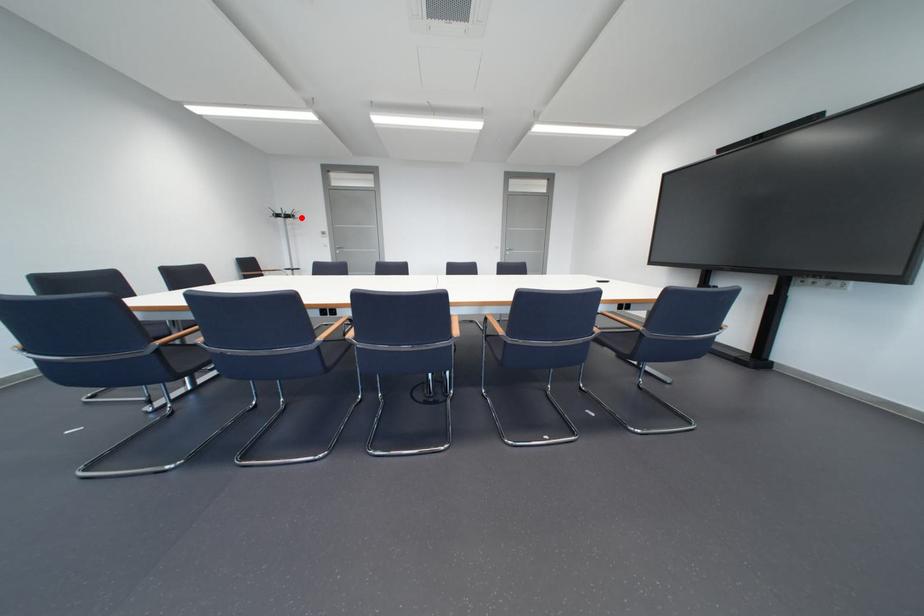
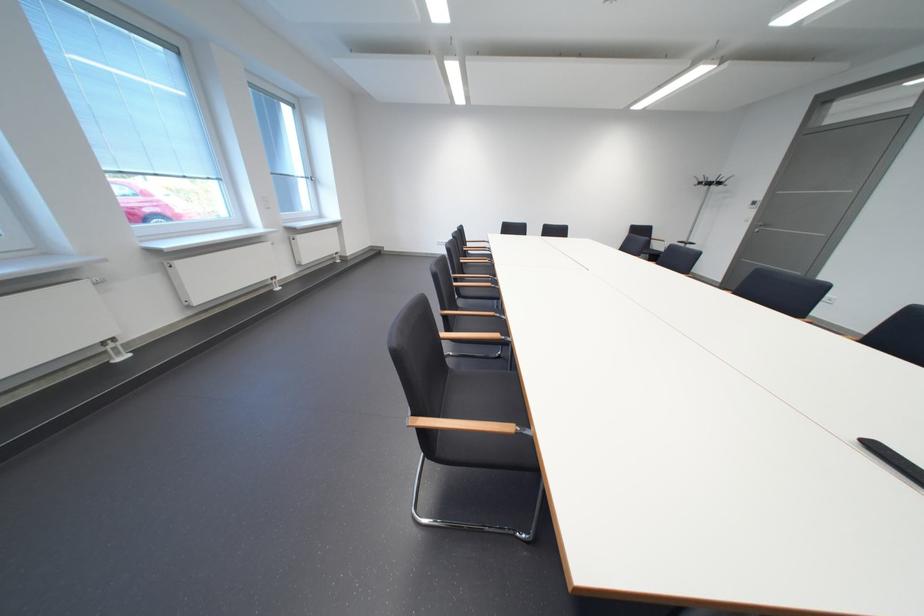
In the second image, find the point that corresponds to the highlighted location in the first image.

(723, 185)